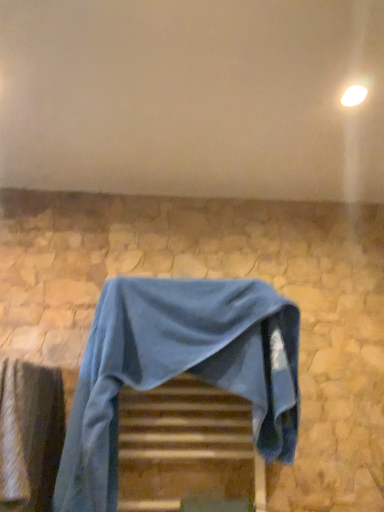
Question: Is blue fabric at lower left wider or thinner than smooth stone wall at upper center?

Choices:
 (A) thin
 (B) wide

Answer: (A)

Question: Which is correct: blue fabric at lower left is inside smooth stone wall at upper center, or outside of it?

Choices:
 (A) inside
 (B) outside

Answer: (B)

Question: Estimate the real-world distances between objects in this image. Which object is farther from the blue fabric-covered chair at center?

Choices:
 (A) blue fabric at lower left
 (B) smooth stone wall at upper center
 (C) wooden at center

Answer: (B)

Question: Which object is positioned farthest from the blue fabric-covered chair at center?

Choices:
 (A) blue fabric at lower left
 (B) wooden at center
 (C) smooth stone wall at upper center

Answer: (C)